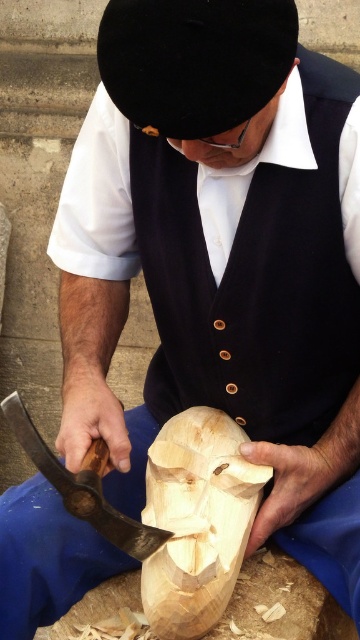
You are an apprentice woodworker observing the scene. The master is working on two items at the center of the workspace. Which object is taller between the natural wood mask at center and the wooden axe at center?

The natural wood mask at center is taller than the wooden axe at center according to the description.

You are a tailor observing a wood carver wearing a navy blue fabric vest at center and working on a natural wood mask at center. Can you determine if the vest is wider than the mask?

The navy blue fabric vest at center might be wider than natural wood mask at center according to the description.